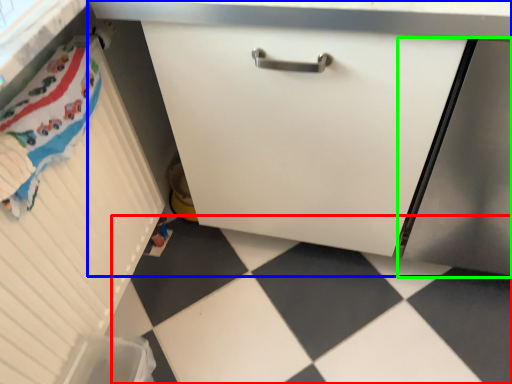
Question: Considering the real-world distances, which object is closest to tile (highlighted by a red box)? cabinetry (highlighted by a blue box) or screen door (highlighted by a green box).

Choices:
 (A) cabinetry
 (B) screen door

Answer: (A)